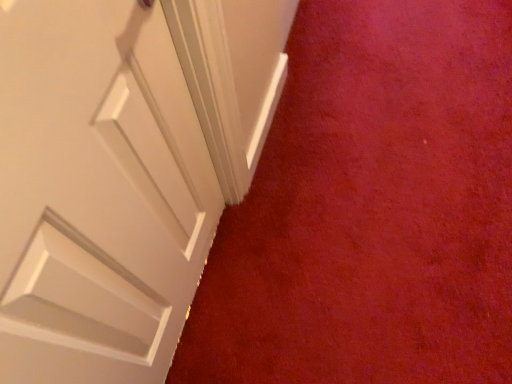
Question: Looking at their shapes, would you say matte white door at upper left is wider or thinner than white matte door at upper left?

Choices:
 (A) wide
 (B) thin

Answer: (A)

Question: From the image's perspective, is matte white door at upper left located above or below white matte door at upper left?

Choices:
 (A) above
 (B) below

Answer: (A)

Question: Choose the correct answer: Is matte white door at upper left inside white matte door at upper left or outside it?

Choices:
 (A) outside
 (B) inside

Answer: (A)

Question: Looking at their shapes, would you say white matte door at upper left is wider or thinner than matte white door at upper left?

Choices:
 (A) wide
 (B) thin

Answer: (B)

Question: Visually, is white matte door at upper left positioned to the left or to the right of matte white door at upper left?

Choices:
 (A) right
 (B) left

Answer: (B)

Question: Is white matte door at upper left inside the boundaries of matte white door at upper left, or outside?

Choices:
 (A) inside
 (B) outside

Answer: (B)

Question: Relative to matte white door at upper left, is white matte door at upper left in front or behind?

Choices:
 (A) behind
 (B) front

Answer: (B)